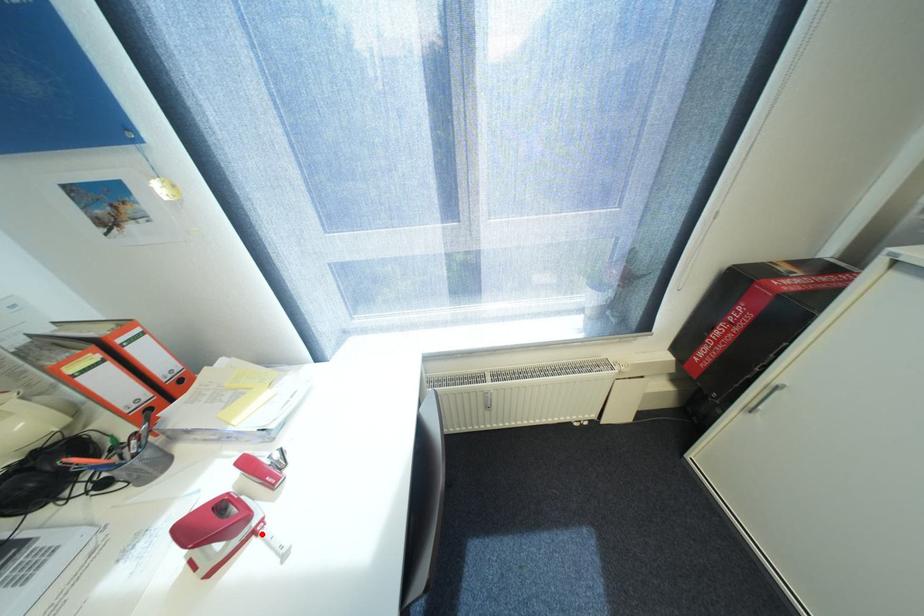
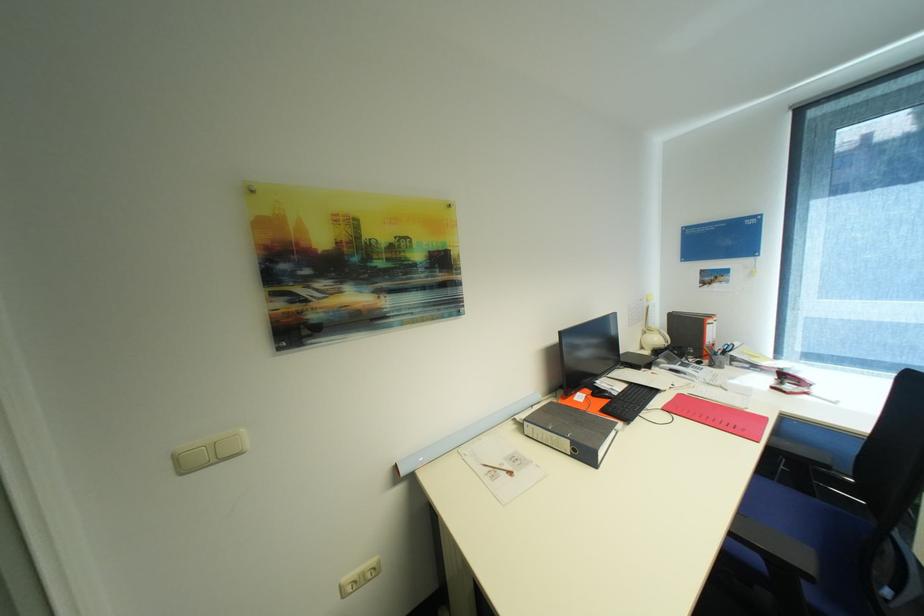
Find the pixel in the second image that matches the highlighted location in the first image.

(813, 394)